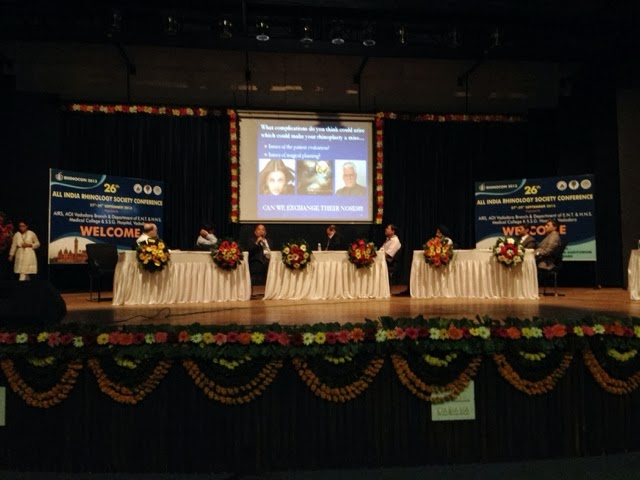
Where is `speaker`? The width and height of the screenshot is (640, 480). speaker is located at coordinates (29, 306).